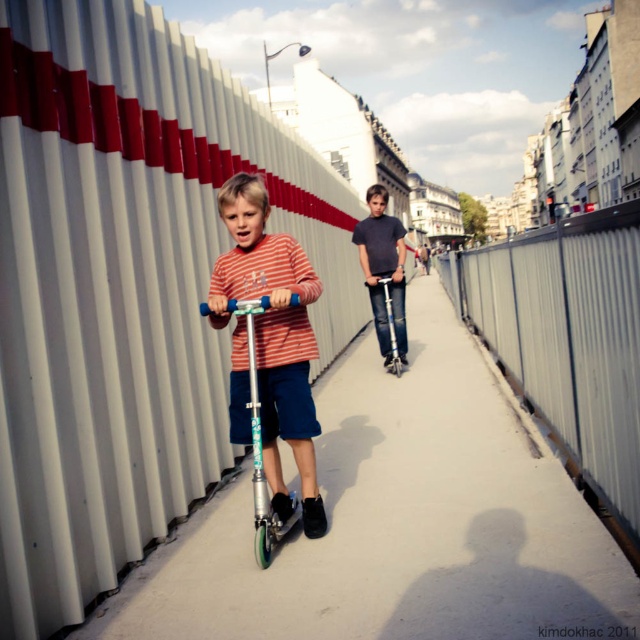
Question: Based on their relative distances, which object is nearer to the metallic silver scooter at center?

Choices:
 (A) matte gray shirt at center
 (B) white corrugated metal fence at center

Answer: (A)

Question: Which object is closer to the camera taking this photo?

Choices:
 (A) matte gray shirt at center
 (B) white corrugated metal fence at center
 (C) matte gray pavement at center

Answer: (C)

Question: Is metallic silver fence at right to the right of striped cotton shirt at center from the viewer's perspective?

Choices:
 (A) no
 (B) yes

Answer: (B)

Question: Considering the relative positions of metallic silver fence at right and matte gray shirt at center in the image provided, where is metallic silver fence at right located with respect to matte gray shirt at center?

Choices:
 (A) above
 (B) below

Answer: (A)

Question: From the image, what is the correct spatial relationship of teal glossy scooter at center in relation to metallic silver scooter at center?

Choices:
 (A) above
 (B) below

Answer: (B)

Question: Which object appears farthest from the camera in this image?

Choices:
 (A) white corrugated metal fence at center
 (B) striped cotton shirt at center

Answer: (B)